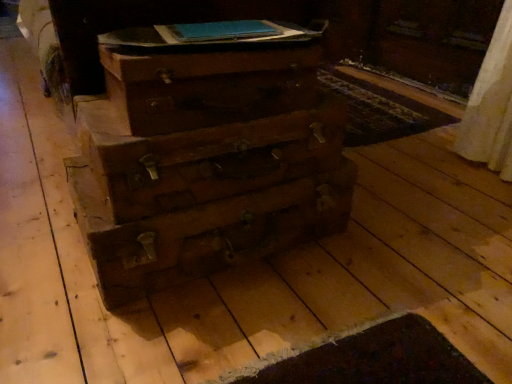
Question: Considering the positions of wooden chest of drawers at center and wooden drawer at center, which appears as the second drawer when viewed from the top, in the image, is wooden chest of drawers at center taller or shorter than wooden drawer at center, which appears as the second drawer when viewed from the top,?

Choices:
 (A) tall
 (B) short

Answer: (B)

Question: Looking at their shapes, would you say wooden chest of drawers at center is wider or thinner than wooden drawer at center, which appears as the second drawer when viewed from the top?

Choices:
 (A) thin
 (B) wide

Answer: (B)

Question: Which is farther from the wooden drawer at center, which is counted as the 2th drawer, starting from the bottom?

Choices:
 (A) blue paper book at upper center
 (B) wooden drawer at center, which appears as the second drawer when viewed from the top
 (C) wooden chest of drawers at center

Answer: (B)

Question: Estimate the real-world distances between objects in this image. Which object is closer to the blue paper book at upper center?

Choices:
 (A) wooden drawer at center, which is counted as the 2th drawer, starting from the bottom
 (B) wooden chest of drawers at center
 (C) wooden drawer at center, which appears as the second drawer when viewed from the top

Answer: (A)